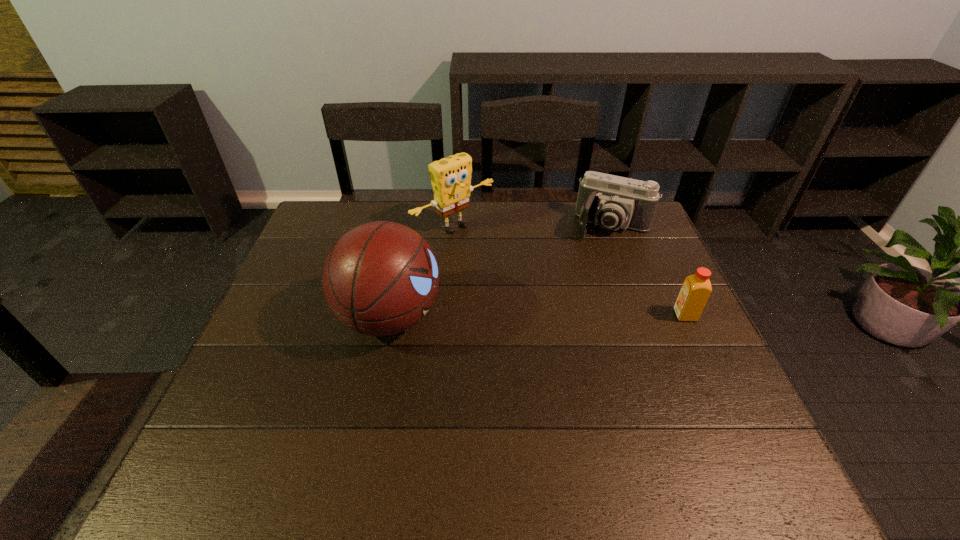
The image size is (960, 540). Find the location of `empty space between the sponge and the orange juice`. empty space between the sponge and the orange juice is located at coordinates (569, 271).

This screenshot has width=960, height=540. I want to click on vacant area that lies between the basketball and the orange juice, so click(x=538, y=316).

This screenshot has height=540, width=960. Find the location of `free spot between the orange juice and the sponge`. free spot between the orange juice and the sponge is located at coordinates (569, 271).

The width and height of the screenshot is (960, 540). I want to click on blank region between the camera and the basketball, so click(x=501, y=271).

Select which object appears as the second closest to the basketball. Please provide its 2D coordinates. Your answer should be formatted as a tuple, i.e. [(x, y)], where the tuple contains the x and y coordinates of a point satisfying the conditions above.

[(613, 202)]

Identify the location of the second closest object to the basketball. (613, 202).

Where is `free point that satisfies the following two spatial constraints: 1. on the back side of the camera; 2. on the left side of the sponge`? The width and height of the screenshot is (960, 540). free point that satisfies the following two spatial constraints: 1. on the back side of the camera; 2. on the left side of the sponge is located at coordinates (454, 226).

At what (x,y) coordinates should I click in order to perform the action: click on vacant space that satisfies the following two spatial constraints: 1. on the front side of the orange juice; 2. on the front and back of the sponge. Please return your answer as a coordinate pair (x, y). Looking at the image, I should click on click(447, 315).

Image resolution: width=960 pixels, height=540 pixels. In order to click on vacant space that satisfies the following two spatial constraints: 1. on the back side of the basketball; 2. on the left side of the camera in this screenshot , I will do `click(409, 226)`.

Locate an element on the screen. free region that satisfies the following two spatial constraints: 1. on the front side of the camera; 2. on the front and back of the orange juice is located at coordinates (646, 315).